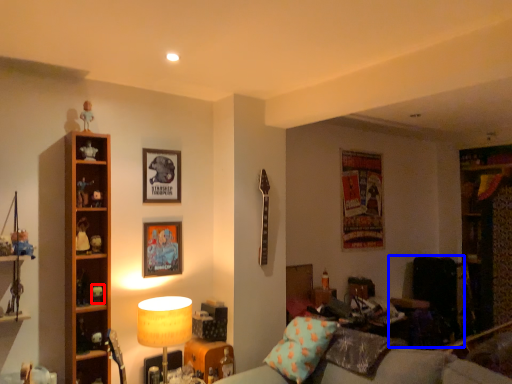
Question: Which object is closer to the camera taking this photo, toy (highlighted by a red box) or swivel chair (highlighted by a blue box)?

Choices:
 (A) toy
 (B) swivel chair

Answer: (A)